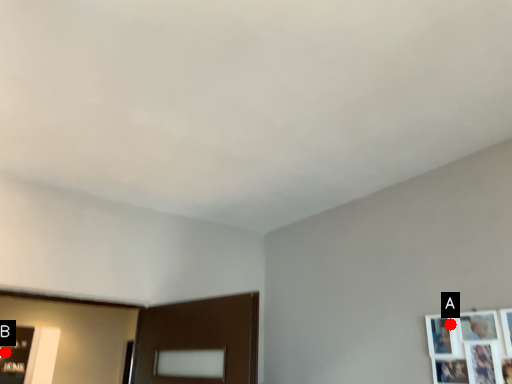
Question: Two points are circled on the image, labeled by A and B beside each circle. Which point is further to the camera?

Choices:
 (A) A is further
 (B) B is further

Answer: (B)